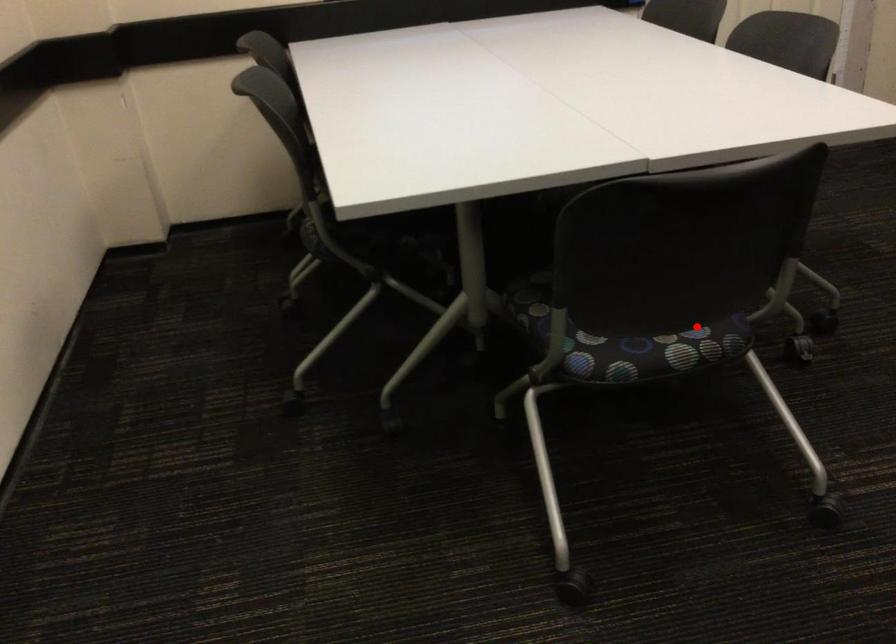
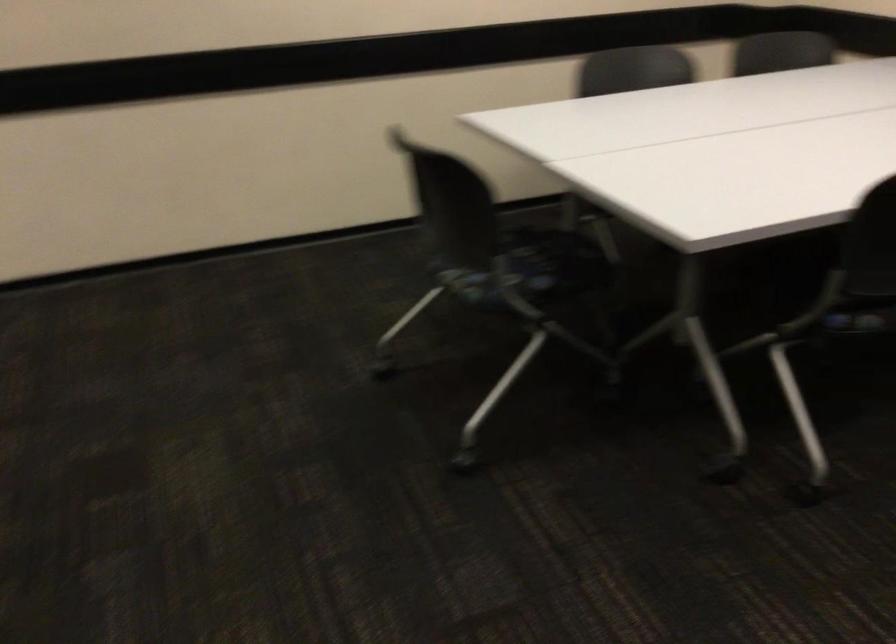
Question: I am providing you with two images of the same scene from different viewpoints. Image1 has a red point marked. In image2, the corresponding 3D location appears at what relative position? Reply with the corresponding letter.

Choices:
 (A) Closer
 (B) Farther

Answer: (B)